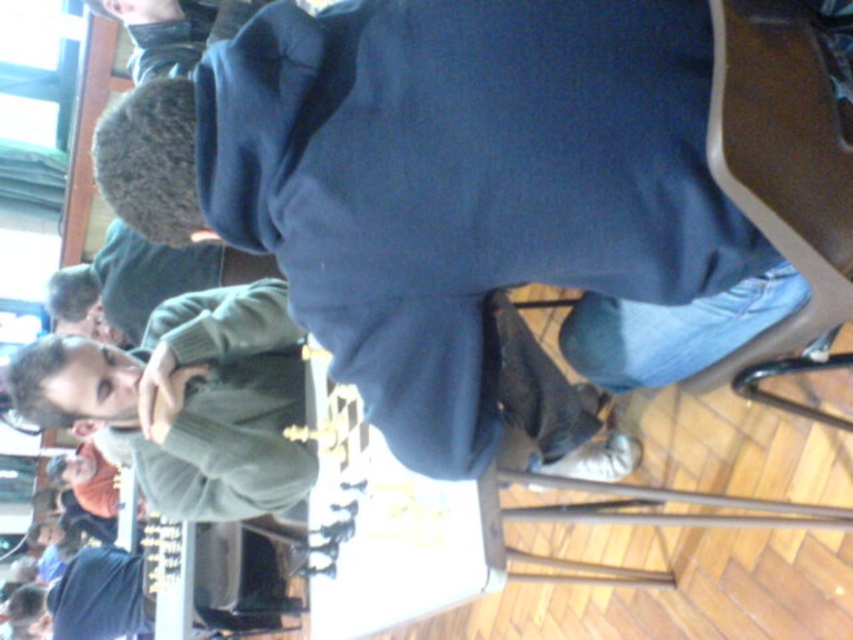
Does dark blue sweatshirt at center have a smaller size compared to brown fabric chair at lower right?

Indeed, dark blue sweatshirt at center has a smaller size compared to brown fabric chair at lower right.

Is dark blue sweatshirt at center below brown fabric chair at lower right?

No.

Image resolution: width=853 pixels, height=640 pixels. Describe the element at coordinates (460, 193) in the screenshot. I see `dark blue sweatshirt at center` at that location.

You are a GUI agent. You are given a task and a screenshot of the screen. Output one action in this format:
    pyautogui.click(x=<x>, y=<y>)
    Task: Click on the dark blue sweatshirt at center
    
    Given the screenshot: What is the action you would take?
    pyautogui.click(x=460, y=193)